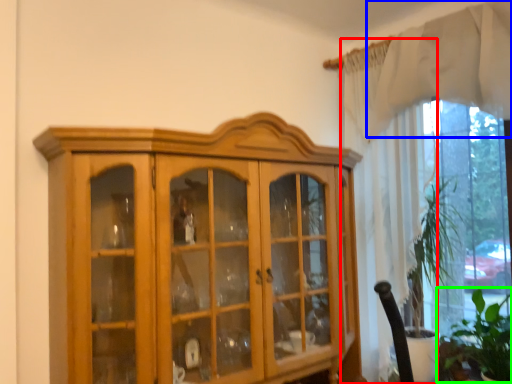
Question: Which object is positioned farthest from curtain (highlighted by a red box)? Select from curtain (highlighted by a blue box) and plant (highlighted by a green box).

Choices:
 (A) curtain
 (B) plant

Answer: (B)